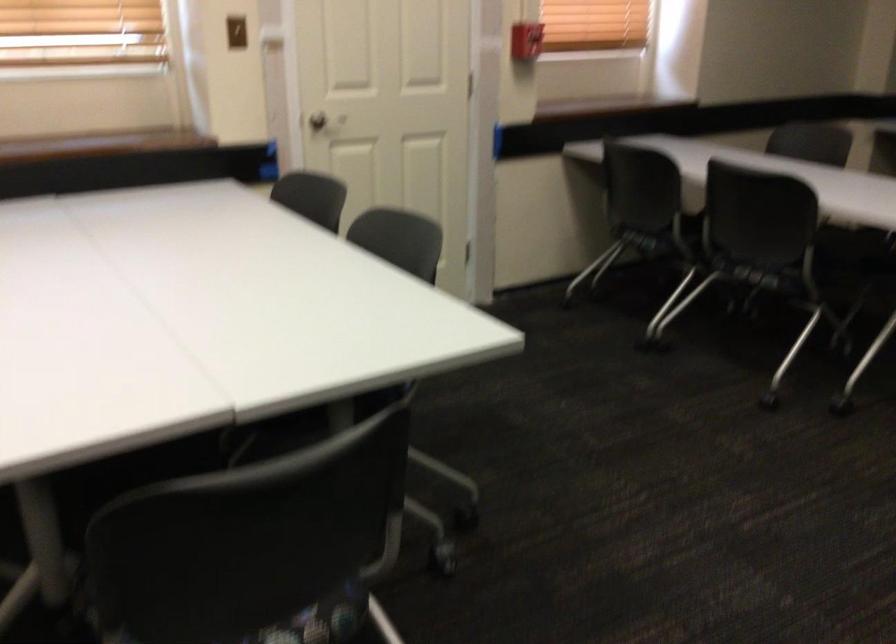
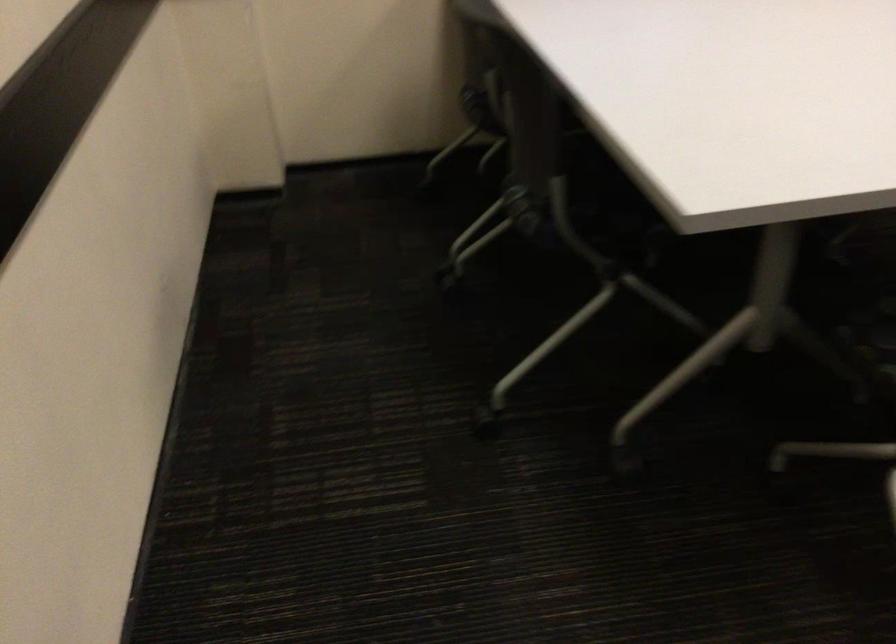
Based on the continuous images, in which direction is the camera rotating?

The camera rotated toward left-down.